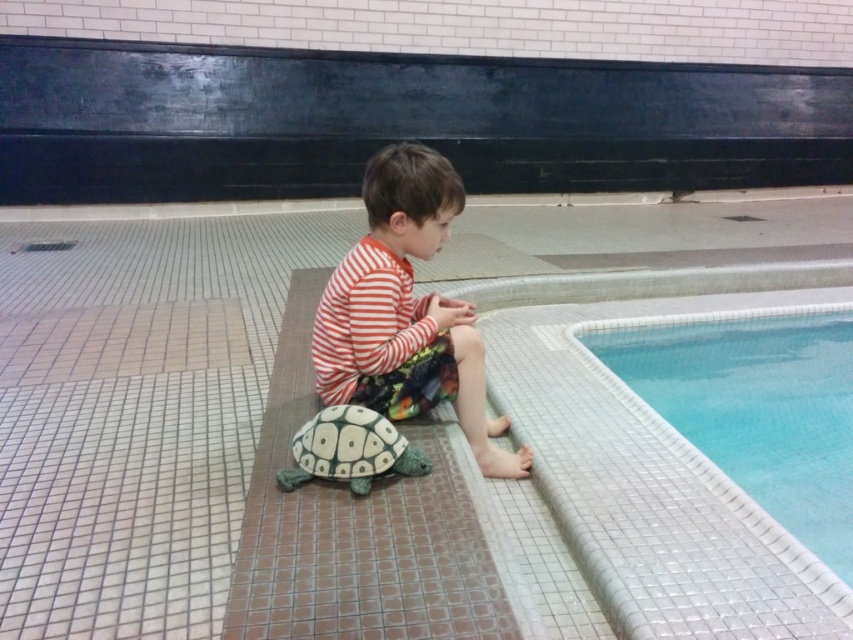
Based on the photo, you are designing a safety sticker for the pool area and need to know the relative sizes of the white mosaic tile at upper right and the striped fabric child at center. Which object is wider?

The white mosaic tile at upper right is wider than the striped fabric child at center.